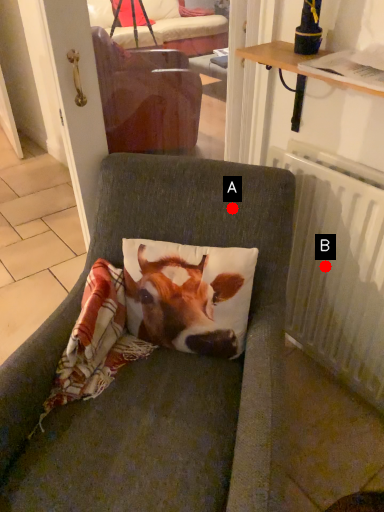
Question: Two points are circled on the image, labeled by A and B beside each circle. Which point appears farthest from the camera in this image?

Choices:
 (A) A is further
 (B) B is further

Answer: (B)